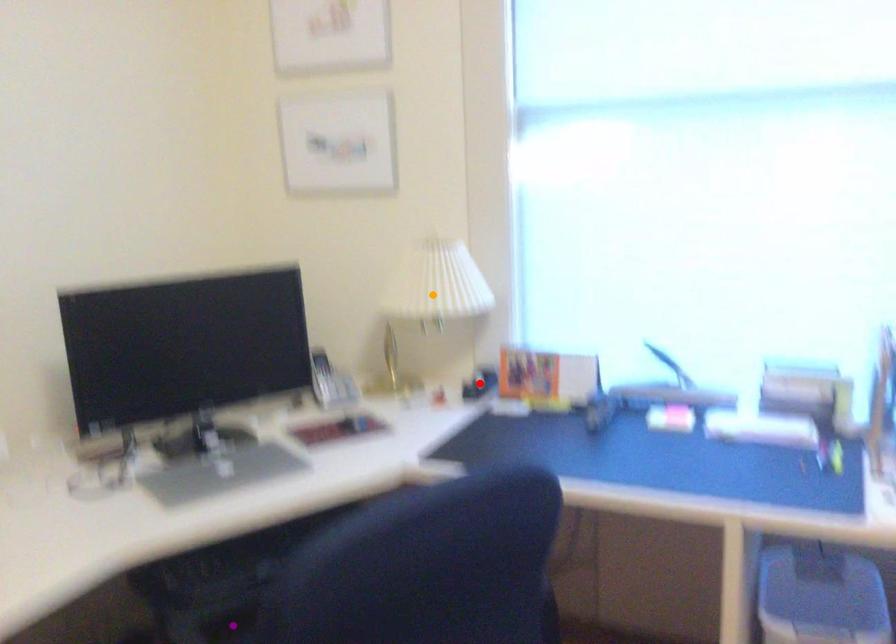
Order these from nearest to farthest:
orange point
red point
purple point

purple point, orange point, red point